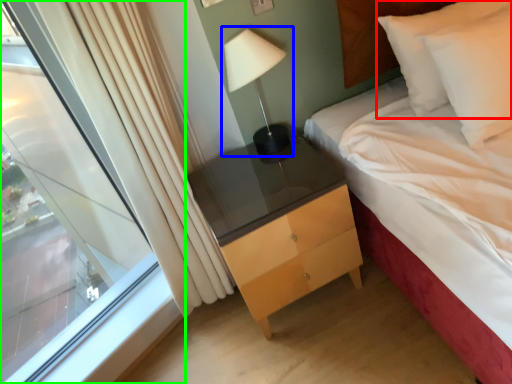
Question: Which object is positioned closest to pillow (highlighted by a red box)? Select from bedside lamp (highlighted by a blue box) and window (highlighted by a green box).

Choices:
 (A) bedside lamp
 (B) window

Answer: (A)